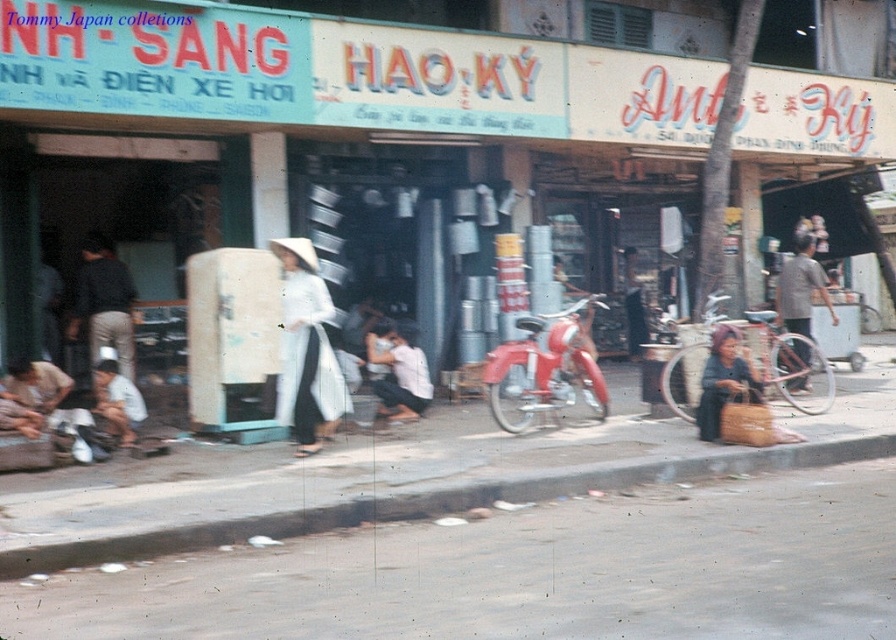
Can you confirm if white silk ao dai at center is wider than dark blue fabric bag at lower right?

Yes, white silk ao dai at center is wider than dark blue fabric bag at lower right.

Is white silk ao dai at center below dark blue fabric bag at lower right?

Actually, white silk ao dai at center is above dark blue fabric bag at lower right.

Locate an element on the screen. This screenshot has height=640, width=896. white silk ao dai at center is located at coordinates (306, 349).

Where is `white silk ao dai at center`? white silk ao dai at center is located at coordinates (306, 349).

Is gray concrete curb at lower center to the right of dark blue fabric bag at lower right from the viewer's perspective?

No, gray concrete curb at lower center is not to the right of dark blue fabric bag at lower right.

Who is shorter, gray concrete curb at lower center or dark blue fabric bag at lower right?

Standing shorter between the two is gray concrete curb at lower center.

Based on the photo, measure the distance between point (99, 552) and camera.

25.72 feet

Find the location of a particular element. The height and width of the screenshot is (640, 896). gray concrete curb at lower center is located at coordinates (428, 502).

Which is behind, point (679, 492) or point (725, 344)?

Point (725, 344)

Is point (82, 536) closer to camera compared to point (751, 401)?

Yes.

What are the coordinates of `smooth concrete pavement at center` in the screenshot? It's located at (470, 532).